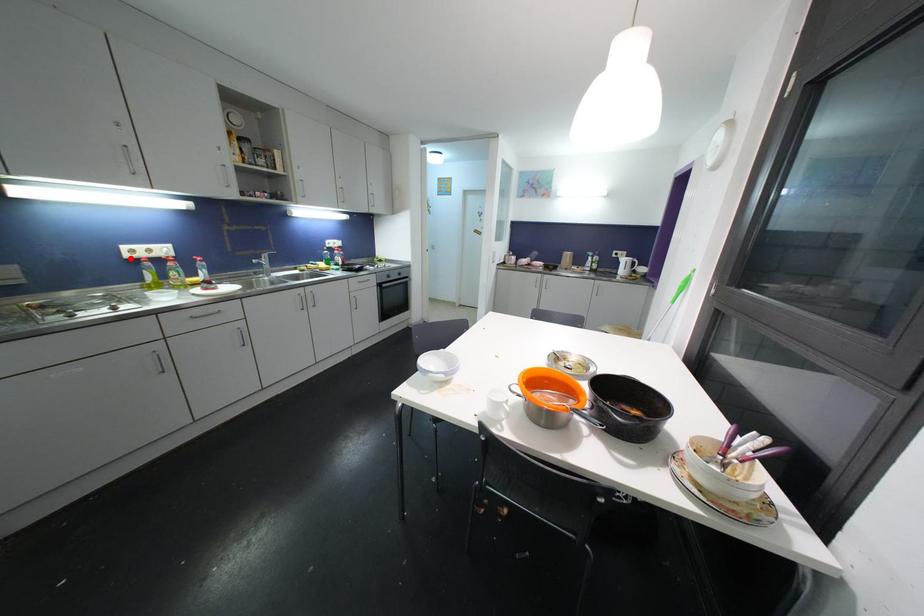
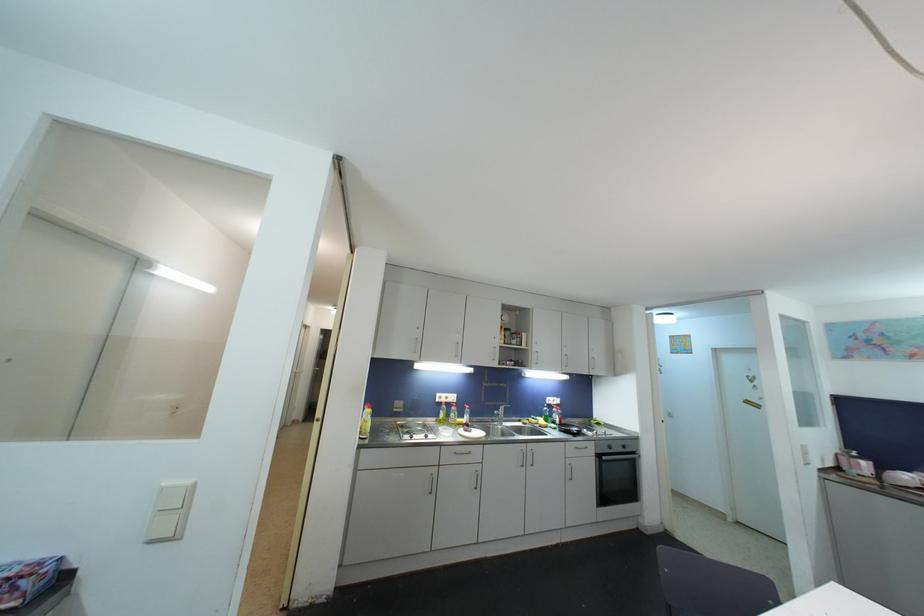
Question: I am providing you with two images of the same scene from different viewpoints. Image1 has a red point marked. In image2, the corresponding 3D location appears at what relative position? Reply with the corresponding letter.

Choices:
 (A) Closer
 (B) Farther

Answer: (B)